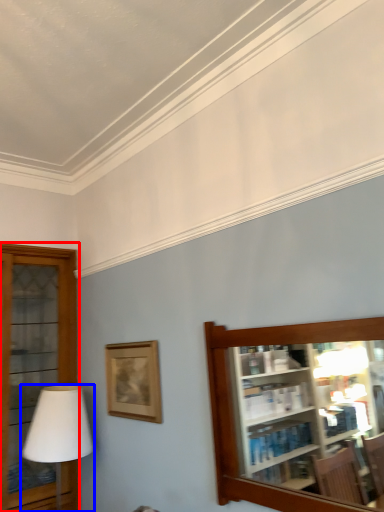
Question: Which point is closer to the camera, shelf (highlighted by a red box) or table lamp (highlighted by a blue box)?

Choices:
 (A) shelf
 (B) table lamp

Answer: (B)